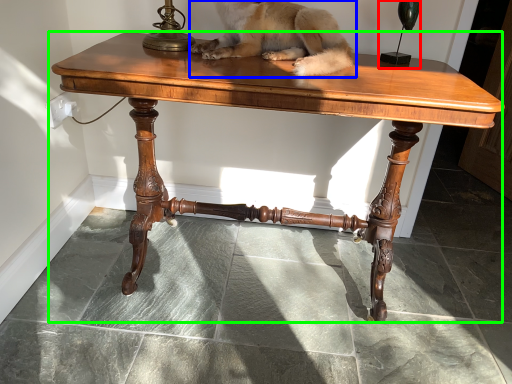
Question: Which is farther away from candle holder (highlighted by a red box)? dog (highlighted by a blue box) or table (highlighted by a green box)?

Choices:
 (A) dog
 (B) table

Answer: (B)